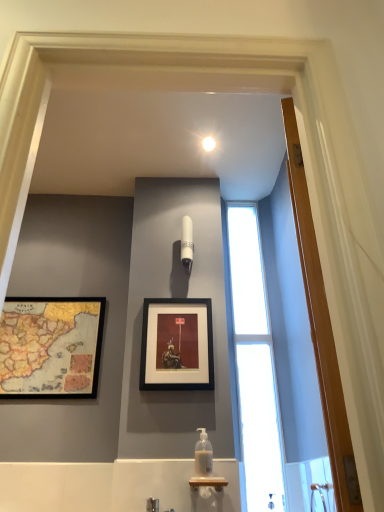
Question: Is wooden door at right far from black matte picture frame at center, which is counted as the first picture frame, starting from the right?

Choices:
 (A) no
 (B) yes

Answer: (B)

Question: Is wooden door at right looking in the opposite direction of black matte picture frame at center, the 2th picture frame when ordered from left to right?

Choices:
 (A) yes
 (B) no

Answer: (B)

Question: Does wooden door at right come in front of black matte picture frame at center, the 2th picture frame when ordered from left to right?

Choices:
 (A) yes
 (B) no

Answer: (A)

Question: Can black matte picture frame at center, which is counted as the first picture frame, starting from the right, be found inside wooden door at right?

Choices:
 (A) no
 (B) yes

Answer: (A)

Question: From a real-world perspective, is wooden door at right on black matte picture frame at center, which is counted as the first picture frame, starting from the right?

Choices:
 (A) yes
 (B) no

Answer: (B)

Question: Can you confirm if wooden door at right is wider than black matte picture frame at center, the 2th picture frame when ordered from left to right?

Choices:
 (A) yes
 (B) no

Answer: (A)

Question: Is brushed metal faucet at lower center facing towards white glossy light fixture at upper center?

Choices:
 (A) yes
 (B) no

Answer: (B)

Question: From a real-world perspective, is brushed metal faucet at lower center physically below white glossy light fixture at upper center?

Choices:
 (A) no
 (B) yes

Answer: (B)

Question: Considering the relative sizes of brushed metal faucet at lower center and white glossy light fixture at upper center in the image provided, is brushed metal faucet at lower center bigger than white glossy light fixture at upper center?

Choices:
 (A) no
 (B) yes

Answer: (B)

Question: Does brushed metal faucet at lower center come behind white glossy light fixture at upper center?

Choices:
 (A) yes
 (B) no

Answer: (B)

Question: Does brushed metal faucet at lower center have a lesser height compared to white glossy light fixture at upper center?

Choices:
 (A) no
 (B) yes

Answer: (A)

Question: From the image's perspective, is brushed metal faucet at lower center over white glossy light fixture at upper center?

Choices:
 (A) no
 (B) yes

Answer: (A)

Question: From a real-world perspective, is wooden framed map at left, arranged as the 2th picture frame when viewed from the right, beneath translucent plastic soap dispenser at center?

Choices:
 (A) yes
 (B) no

Answer: (B)